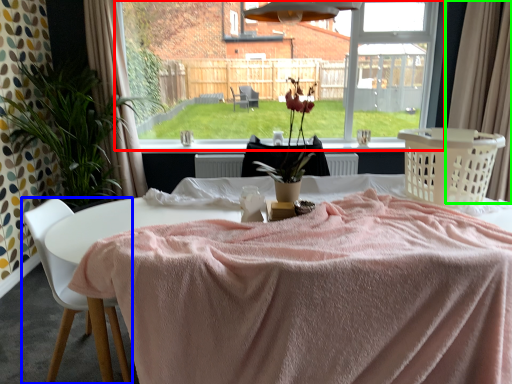
Question: Which object is the closest to the window (highlighted by a red box)? Choose among these: chair (highlighted by a blue box) or curtain (highlighted by a green box).

Choices:
 (A) chair
 (B) curtain

Answer: (B)